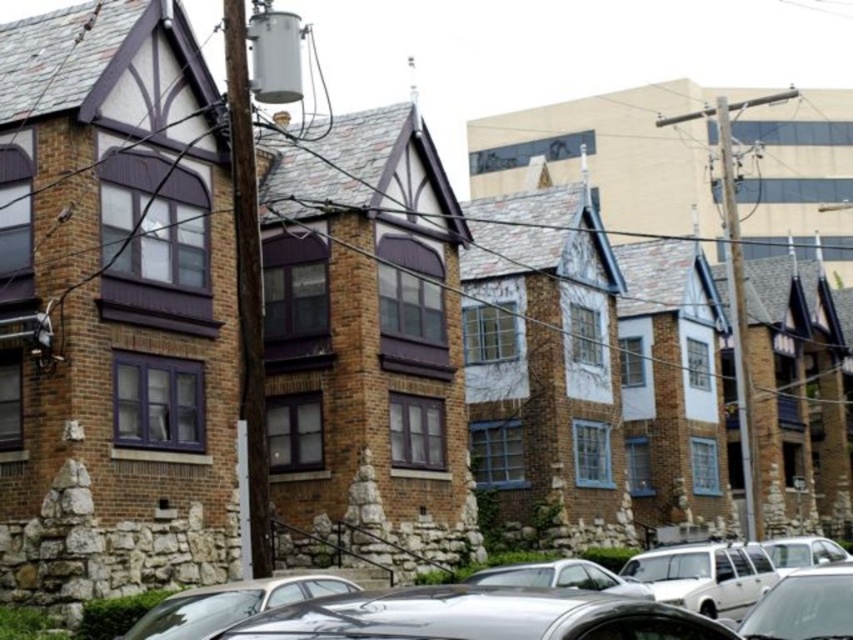
Can you confirm if shiny silver car at lower center is thinner than shiny silver car at lower right?

No, shiny silver car at lower center is not thinner than shiny silver car at lower right.

How distant is shiny silver car at lower center from shiny silver car at lower right?

shiny silver car at lower center and shiny silver car at lower right are 15.82 meters apart.

I want to click on shiny silver car at lower center, so click(x=229, y=604).

Where is `shiny silver car at lower center`? shiny silver car at lower center is located at coordinates (229, 604).

Which is behind, point (154, 621) or point (496, 582)?

The point (496, 582) is behind.

The height and width of the screenshot is (640, 853). In order to click on shiny silver car at lower center in this screenshot , I will do `click(229, 604)`.

The width and height of the screenshot is (853, 640). Identify the location of shiny silver car at lower center. pos(229,604).

Is point (758, 573) positioned before point (146, 618)?

No, (758, 573) is further to viewer.

Can you confirm if white matte station wagon at lower center is positioned to the left of shiny silver car at lower center?

No, white matte station wagon at lower center is not to the left of shiny silver car at lower center.

Which is behind, point (676, 579) or point (161, 600)?

The point (676, 579) is more distant.

The image size is (853, 640). In order to click on white matte station wagon at lower center in this screenshot , I will do `click(705, 576)`.